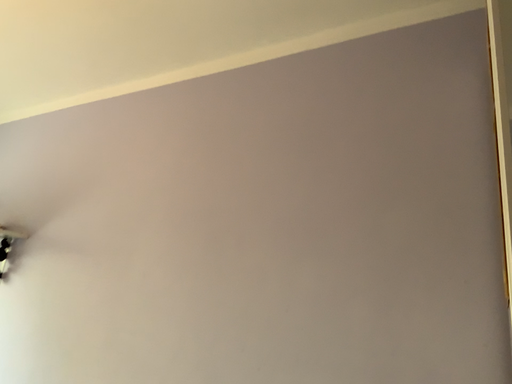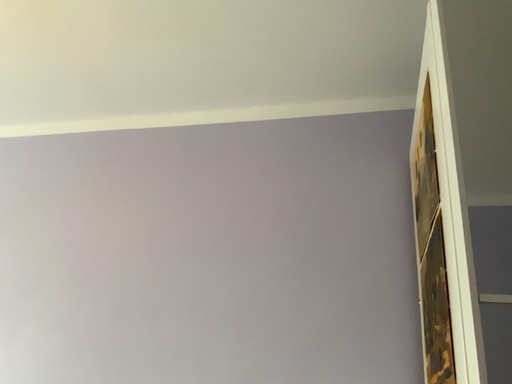
Question: Which way did the camera rotate in the video?

Choices:
 (A) rotated left
 (B) rotated right

Answer: (B)